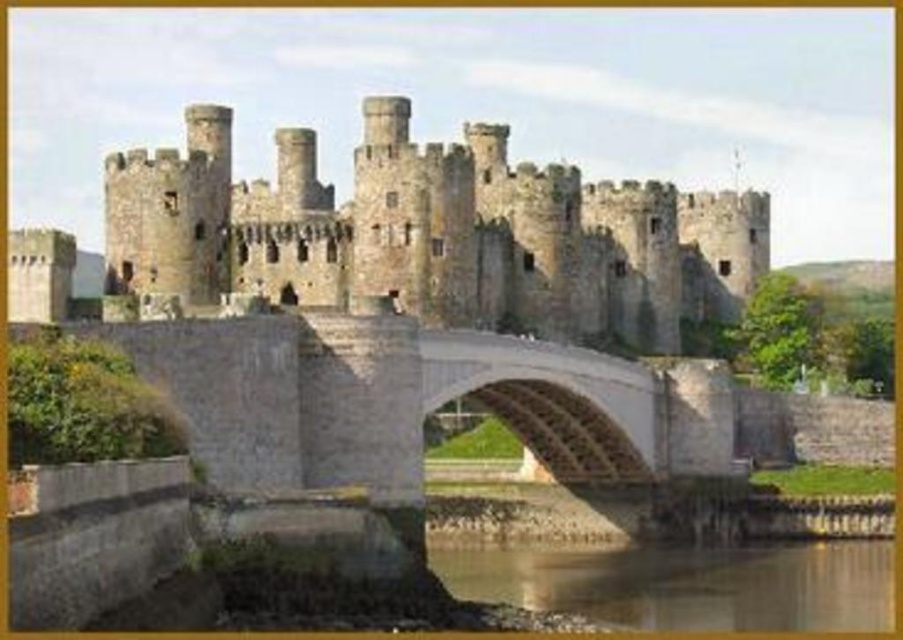
Which is in front, point (253, 332) or point (622, 596)?

Point (253, 332) is more forward.

Does stone bridge at center come in front of reflective glass water at lower center?

Yes, stone bridge at center is closer to the viewer.

Does point (314, 472) come closer to viewer compared to point (566, 600)?

That is True.

In order to click on stone bridge at center in this screenshot , I will do `click(419, 401)`.

Is point (290, 301) in front of point (526, 568)?

No, (290, 301) is behind (526, 568).

Describe the element at coordinates (433, 234) in the screenshot. I see `rustic stone castle at center` at that location.

This screenshot has height=640, width=903. What do you see at coordinates (433, 234) in the screenshot? I see `rustic stone castle at center` at bounding box center [433, 234].

Identify the location of rustic stone castle at center. The image size is (903, 640). 433,234.

Who is shorter, rustic stone castle at center or stone bridge at center?

With less height is stone bridge at center.

Is point (469, 221) in front of point (405, 413)?

No, (469, 221) is behind (405, 413).

Find the location of `rustic stone castle at center`. rustic stone castle at center is located at coordinates (433, 234).